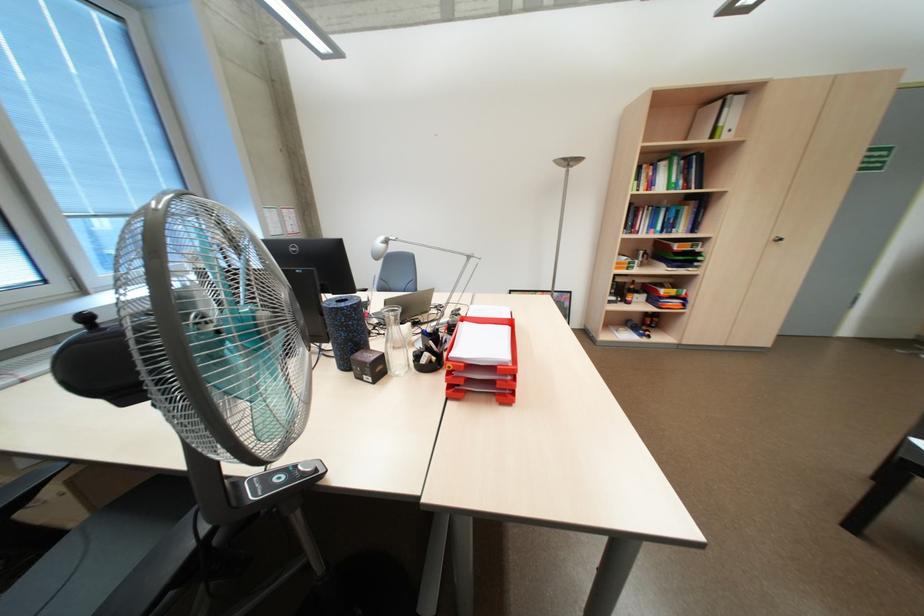
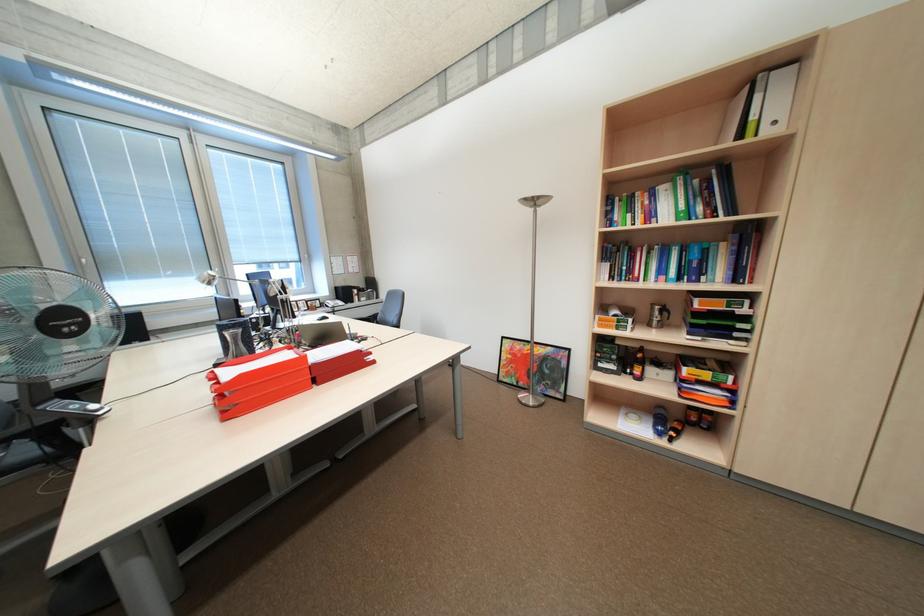
The point at (661,184) is marked in the first image. Where is the corresponding point in the second image?

(661, 215)